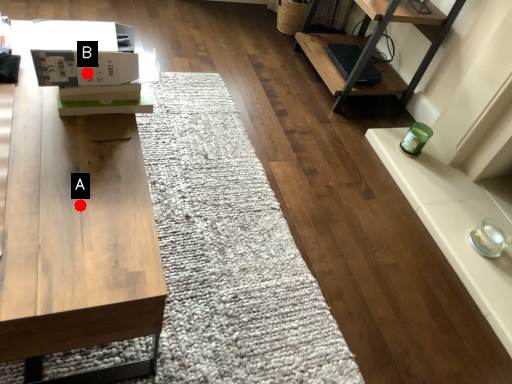
Question: Two points are circled on the image, labeled by A and B beside each circle. Which point is closer to the camera taking this photo?

Choices:
 (A) A is closer
 (B) B is closer

Answer: (A)